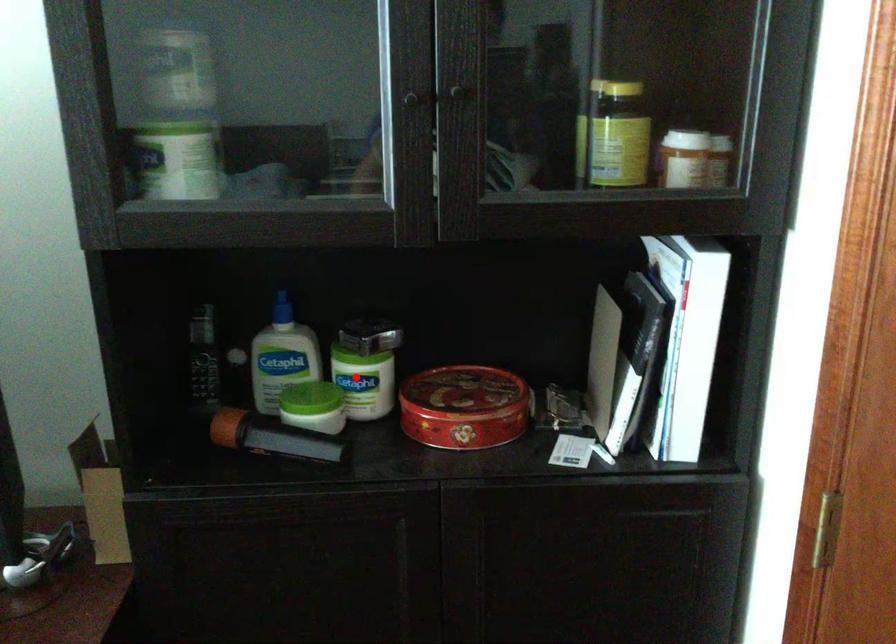
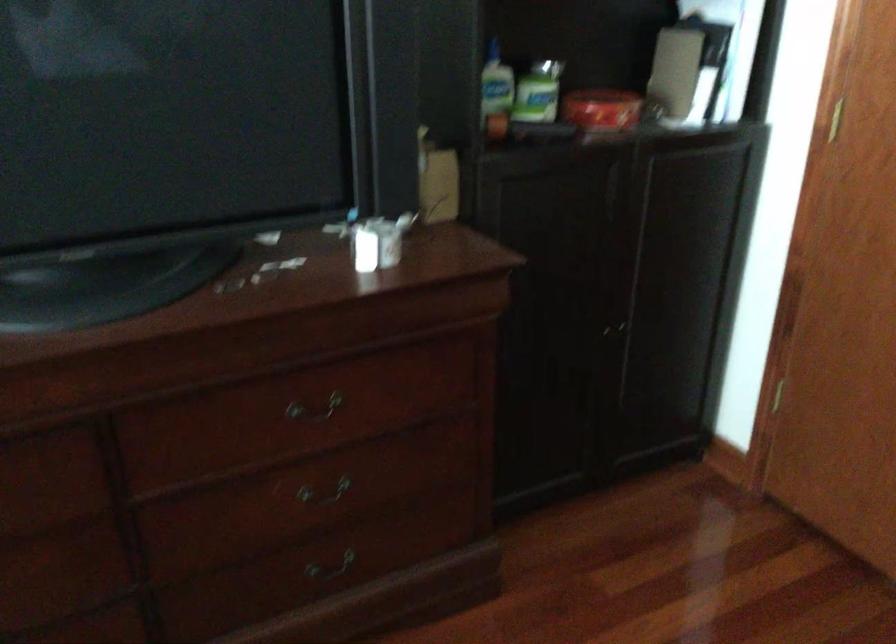
In the second image, find the point that corresponds to the highlighted location in the first image.

(538, 91)